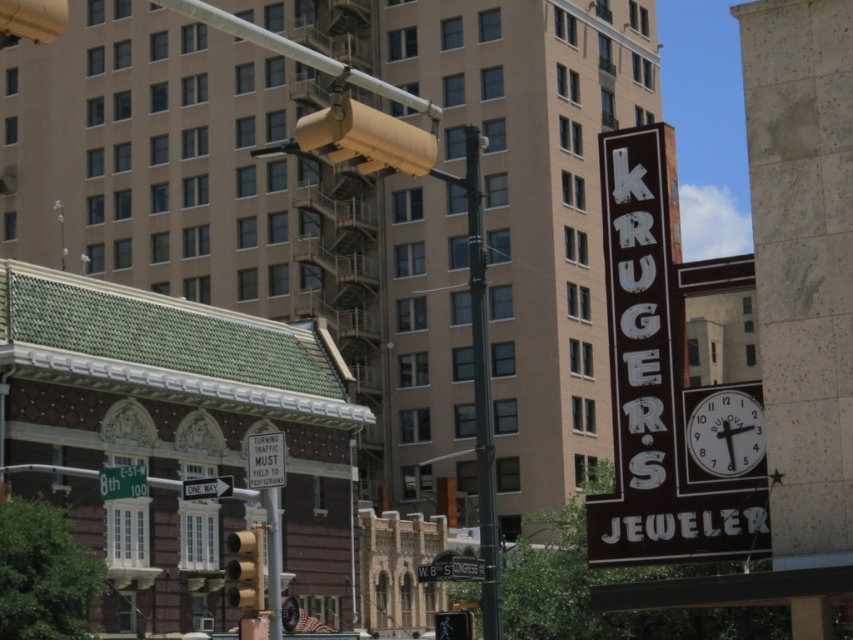
You are a delivery driver approaching an intersection and need to make a turn. You see a metallic yellow traffic light at center and a white plastic one way sign at lower left. Which object is narrower in width?

The metallic yellow traffic light at center has a lesser width compared to the white plastic one way sign at lower left, so it is narrower.

You are a delivery driver needing to read the white plastic sign at center and the matte yellow traffic light at lower center while driving. Which one is wider?

The white plastic sign at center is wider than the matte yellow traffic light at lower center.